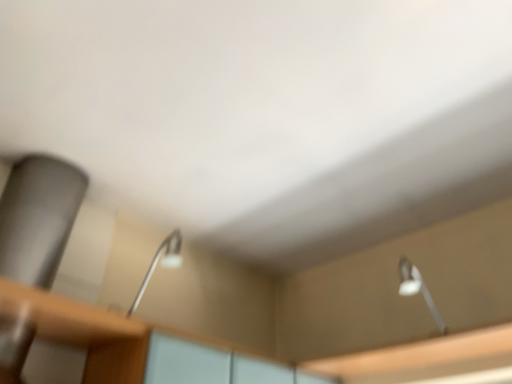
How much space does metallic silver lamp at center, which is counted as the 1th lamp, starting from the left, occupy vertically?

The height of metallic silver lamp at center, which is counted as the 1th lamp, starting from the left, is 5.49 inches.

The height and width of the screenshot is (384, 512). I want to click on metallic silver lamp at center, positioned as the 2th lamp in right-to-left order, so click(x=161, y=263).

What is the approximate height of wooden table at lower left?

1.68 inches.

The height and width of the screenshot is (384, 512). I want to click on white glossy lamp at upper right, arranged as the first lamp when viewed from the right, so click(417, 289).

The height and width of the screenshot is (384, 512). I want to click on metallic silver lamp at center, which is counted as the 1th lamp, starting from the left, so click(x=161, y=263).

Can you confirm if metallic silver lamp at center, positioned as the 2th lamp in right-to-left order, is positioned to the right of wooden table at lower left?

Yes.

Does point (164, 261) appear closer or farther from the camera than point (1, 301)?

Point (164, 261).

Is metallic silver lamp at center, which is counted as the 1th lamp, starting from the left, far away from wooden table at lower left?

No.

From a real-world perspective, starting from the wooden table at lower left, which lamp is the 2nd one vertically above it? Please provide its 2D coordinates.

[(161, 263)]

Find the location of a particular element. lamp above the white glossy lamp at upper right, positioned as the second lamp in left-to-right order (from a real-world perspective) is located at coordinates (161, 263).

Considering the sizes of white glossy lamp at upper right, arranged as the first lamp when viewed from the right, and metallic silver lamp at center, positioned as the 2th lamp in right-to-left order, in the image, is white glossy lamp at upper right, arranged as the first lamp when viewed from the right, taller or shorter than metallic silver lamp at center, positioned as the 2th lamp in right-to-left order,?

In the image, white glossy lamp at upper right, arranged as the first lamp when viewed from the right, appears to be shorter than metallic silver lamp at center, positioned as the 2th lamp in right-to-left order.

Looking at the image, does white glossy lamp at upper right, arranged as the first lamp when viewed from the right, seem bigger or smaller compared to metallic silver lamp at center, positioned as the 2th lamp in right-to-left order?

Considering their sizes, white glossy lamp at upper right, arranged as the first lamp when viewed from the right, takes up less space than metallic silver lamp at center, positioned as the 2th lamp in right-to-left order.

Could you tell me if white glossy lamp at upper right, arranged as the first lamp when viewed from the right, is turned towards metallic silver lamp at center, positioned as the 2th lamp in right-to-left order?

No, white glossy lamp at upper right, arranged as the first lamp when viewed from the right, is not aimed at metallic silver lamp at center, positioned as the 2th lamp in right-to-left order.

Is white glossy lamp at upper right, positioned as the second lamp in left-to-right order, with wooden table at lower left?

No, white glossy lamp at upper right, positioned as the second lamp in left-to-right order, is not in contact with wooden table at lower left.

Consider the image. Can you confirm if white glossy lamp at upper right, arranged as the first lamp when viewed from the right, is positioned to the left of wooden table at lower left?

No, white glossy lamp at upper right, arranged as the first lamp when viewed from the right, is not to the left of wooden table at lower left.

Is point (415, 283) positioned in front of point (121, 318)?

No, it is behind (121, 318).

Between wooden table at lower left and metallic silver lamp at center, which is counted as the 1th lamp, starting from the left, which one has larger size?

wooden table at lower left is bigger.

Considering the relative sizes of wooden table at lower left and metallic silver lamp at center, which is counted as the 1th lamp, starting from the left, in the image provided, is wooden table at lower left shorter than metallic silver lamp at center, which is counted as the 1th lamp, starting from the left,?

Indeed, wooden table at lower left has a lesser height compared to metallic silver lamp at center, which is counted as the 1th lamp, starting from the left.

Is wooden table at lower left positioned beyond the bounds of metallic silver lamp at center, which is counted as the 1th lamp, starting from the left?

Yes, wooden table at lower left is not within metallic silver lamp at center, which is counted as the 1th lamp, starting from the left.

From a real-world perspective, which is physically below, wooden table at lower left or metallic silver lamp at center, which is counted as the 1th lamp, starting from the left?

In real-world perspective, wooden table at lower left is lower.

From the image's perspective, relative to white glossy lamp at upper right, arranged as the first lamp when viewed from the right, is metallic silver lamp at center, which is counted as the 1th lamp, starting from the left, above or below?

From the image's perspective, metallic silver lamp at center, which is counted as the 1th lamp, starting from the left, appears above white glossy lamp at upper right, arranged as the first lamp when viewed from the right.

Which of these two, metallic silver lamp at center, positioned as the 2th lamp in right-to-left order, or white glossy lamp at upper right, positioned as the second lamp in left-to-right order, is wider?

With larger width is metallic silver lamp at center, positioned as the 2th lamp in right-to-left order.

Could white glossy lamp at upper right, arranged as the first lamp when viewed from the right, be considered to be inside metallic silver lamp at center, which is counted as the 1th lamp, starting from the left?

Definitely not — white glossy lamp at upper right, arranged as the first lamp when viewed from the right, is not inside metallic silver lamp at center, which is counted as the 1th lamp, starting from the left.

Does metallic silver lamp at center, which is counted as the 1th lamp, starting from the left, have a greater height compared to white glossy lamp at upper right, arranged as the first lamp when viewed from the right?

Indeed, metallic silver lamp at center, which is counted as the 1th lamp, starting from the left, has a greater height compared to white glossy lamp at upper right, arranged as the first lamp when viewed from the right.

Do you think wooden table at lower left is within white glossy lamp at upper right, positioned as the second lamp in left-to-right order, or outside of it?

wooden table at lower left exists outside the volume of white glossy lamp at upper right, positioned as the second lamp in left-to-right order.

Can you confirm if wooden table at lower left is shorter than white glossy lamp at upper right, arranged as the first lamp when viewed from the right?

Correct, wooden table at lower left is not as tall as white glossy lamp at upper right, arranged as the first lamp when viewed from the right.

Considering the sizes of objects wooden table at lower left and white glossy lamp at upper right, positioned as the second lamp in left-to-right order, in the image provided, who is thinner, wooden table at lower left or white glossy lamp at upper right, positioned as the second lamp in left-to-right order,?

With smaller width is white glossy lamp at upper right, positioned as the second lamp in left-to-right order.

There is a wooden table at lower left. At what (x,y) coordinates should I click in order to perform the action: click on the 2nd lamp above it (from the image's perspective). Please return your answer as a coordinate pair (x, y). The height and width of the screenshot is (384, 512). Looking at the image, I should click on (161, 263).

This screenshot has width=512, height=384. There is a white glossy lamp at upper right, positioned as the second lamp in left-to-right order. What are the coordinates of `lamp above it (from a real-world perspective)` in the screenshot? It's located at (161, 263).

Which object lies further to the anchor point white glossy lamp at upper right, positioned as the second lamp in left-to-right order, metallic silver lamp at center, positioned as the 2th lamp in right-to-left order, or wooden table at lower left?

wooden table at lower left.

Considering their positions, is white glossy lamp at upper right, arranged as the first lamp when viewed from the right, positioned further to metallic silver lamp at center, which is counted as the 1th lamp, starting from the left, than wooden table at lower left?

white glossy lamp at upper right, arranged as the first lamp when viewed from the right, lies further to metallic silver lamp at center, which is counted as the 1th lamp, starting from the left, than the other object.

Based on the photo, looking at the image, which one is located closer to metallic silver lamp at center, which is counted as the 1th lamp, starting from the left, wooden table at lower left or white glossy lamp at upper right, arranged as the first lamp when viewed from the right?

wooden table at lower left.

Based on their spatial positions, is metallic silver lamp at center, which is counted as the 1th lamp, starting from the left, or white glossy lamp at upper right, positioned as the second lamp in left-to-right order, closer to wooden table at lower left?

Based on the image, metallic silver lamp at center, which is counted as the 1th lamp, starting from the left, appears to be nearer to wooden table at lower left.

Looking at the image, which one is located closer to white glossy lamp at upper right, positioned as the second lamp in left-to-right order, wooden table at lower left or metallic silver lamp at center, positioned as the 2th lamp in right-to-left order?

Based on the image, metallic silver lamp at center, positioned as the 2th lamp in right-to-left order, appears to be nearer to white glossy lamp at upper right, positioned as the second lamp in left-to-right order.

Considering their positions, is white glossy lamp at upper right, positioned as the second lamp in left-to-right order, positioned further to wooden table at lower left than metallic silver lamp at center, which is counted as the 1th lamp, starting from the left?

The object further to wooden table at lower left is white glossy lamp at upper right, positioned as the second lamp in left-to-right order.

This screenshot has width=512, height=384. In order to click on lamp situated between wooden table at lower left and white glossy lamp at upper right, positioned as the second lamp in left-to-right order, from left to right in this screenshot , I will do `click(161, 263)`.